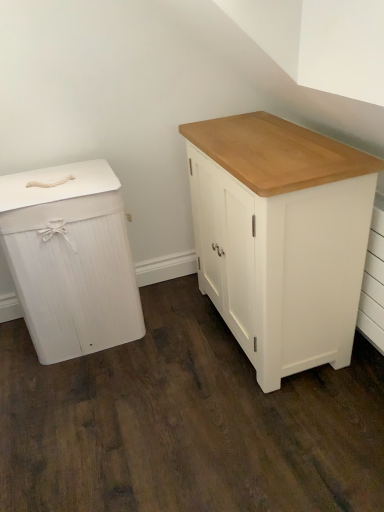
Find the location of a particular element. This screenshot has width=384, height=512. empty space that is ontop of white painted wood cabinet at center, the first chest of drawers viewed from the right (from a real-world perspective) is located at coordinates (261, 140).